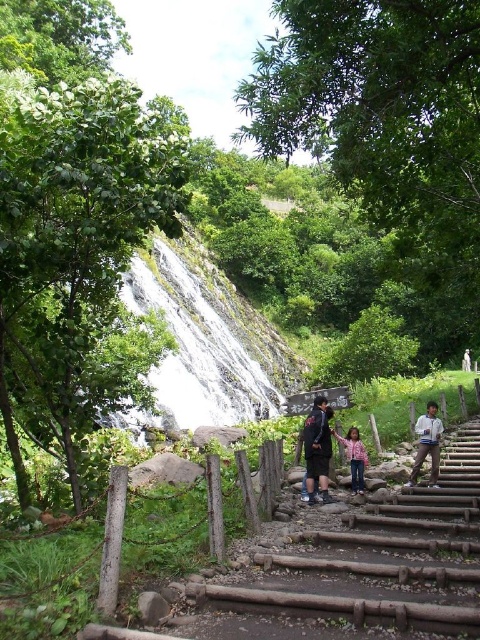
Looking at this image, you are a hiker standing at the bottom of the wooden steps leading up to the waterfall. You see both the white textured waterfall at center and the dark blue fabric jacket at center. Which object is closer to you?

The white textured waterfall at center is closer to you because it is located at the center of the scene, while the dark blue fabric jacket at center is 35.81 meters away from the waterfall, making it farther away from your current position at the bottom of the steps.

You are standing at the bottom of the wooden steps leading to the white textured waterfall at center. You want to climb up to the signboard near the top. Considering the distance of the waterfall from you, can you estimate how many steps you need to climb to reach the signboard?

The white textured waterfall at center is 39.00 meters away from the viewer. Since the signboard is near the top of the steps leading to the waterfall, you would need to climb all the steps to reach it, as the distance suggests the waterfall is quite far away.